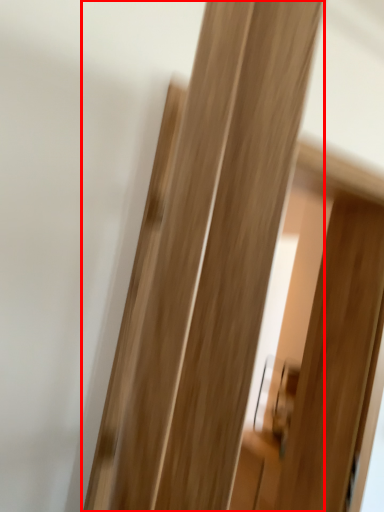
Question: From the image, what is the correct spatial relationship of door (annotated by the red box) in relation to screen door?

Choices:
 (A) left
 (B) right

Answer: (A)